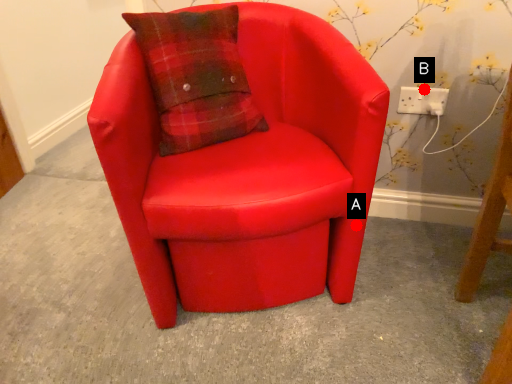
Question: Two points are circled on the image, labeled by A and B beside each circle. Which point is farther from the camera taking this photo?

Choices:
 (A) A is further
 (B) B is further

Answer: (B)